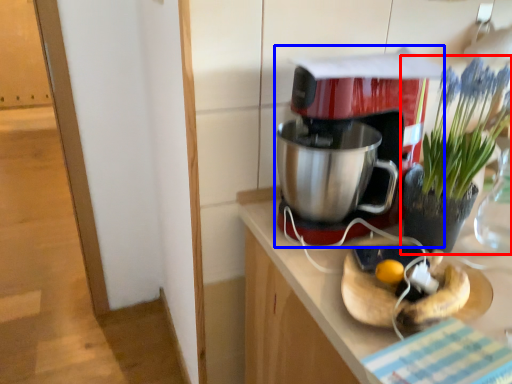
Question: Among these objects, which one is farthest to the camera, houseplant (highlighted by a red box) or coffee maker (highlighted by a blue box)?

Choices:
 (A) houseplant
 (B) coffee maker

Answer: (B)